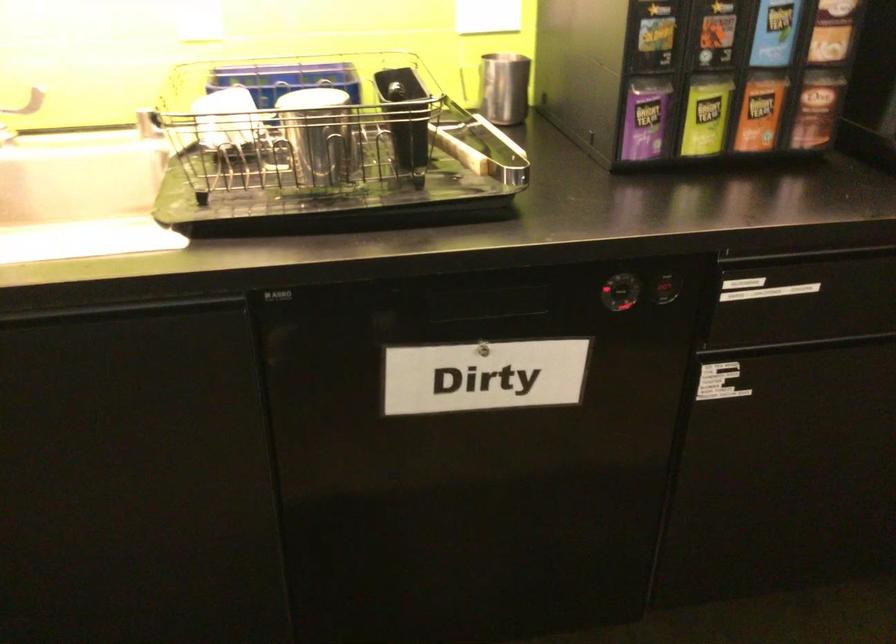
Where is `metal cup`? metal cup is located at coordinates (504, 88).